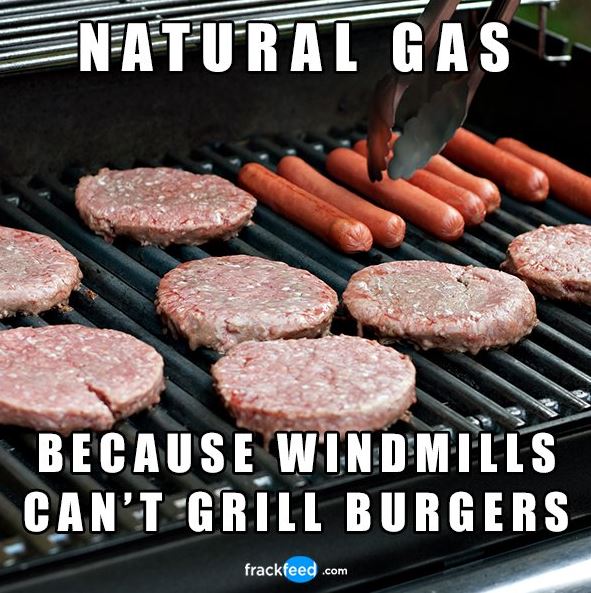
The height and width of the screenshot is (593, 591). Find the location of `prong handles`. prong handles is located at coordinates (439, 14), (506, 12).